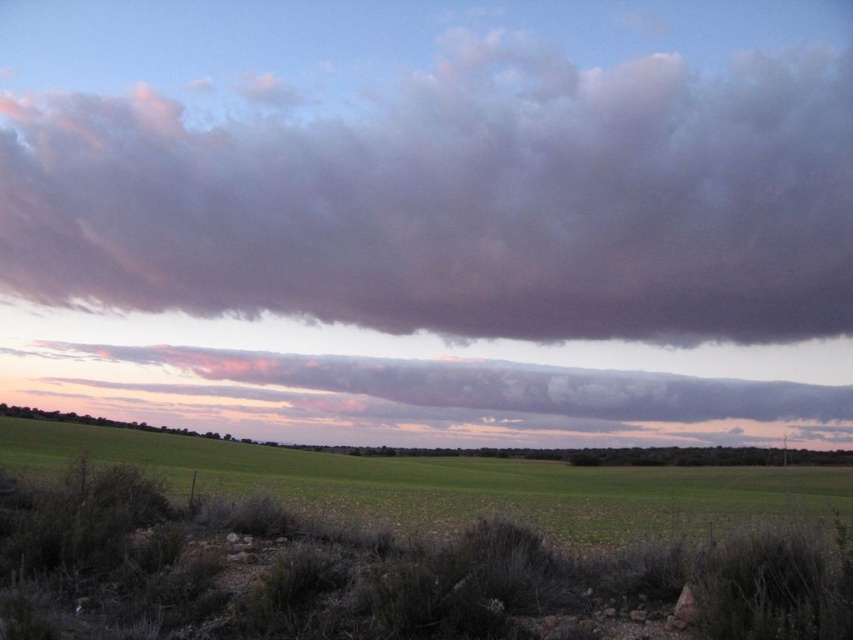
Question: Considering the real-world distances, which object is farthest from the dark gray cloud at upper center?

Choices:
 (A) cloudy gray cloud at upper center
 (B) green grass at lower center

Answer: (B)

Question: Is dark gray cloud at upper center wider than green grass at lower center?

Choices:
 (A) no
 (B) yes

Answer: (B)

Question: Among these objects, which one is nearest to the camera?

Choices:
 (A) cloudy gray cloud at upper center
 (B) green grass at lower center

Answer: (B)

Question: Can you confirm if dark gray cloud at upper center is positioned to the right of cloudy gray cloud at upper center?

Choices:
 (A) no
 (B) yes

Answer: (B)

Question: Can you confirm if dark gray cloud at upper center is bigger than green grass at lower center?

Choices:
 (A) yes
 (B) no

Answer: (A)

Question: Among these points, which one is farthest from the camera?

Choices:
 (A) (619, 246)
 (B) (428, 364)
 (C) (281, 570)

Answer: (A)